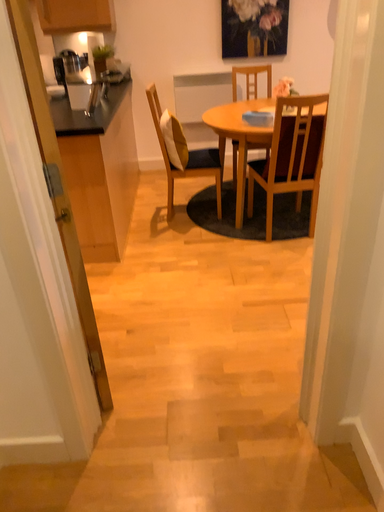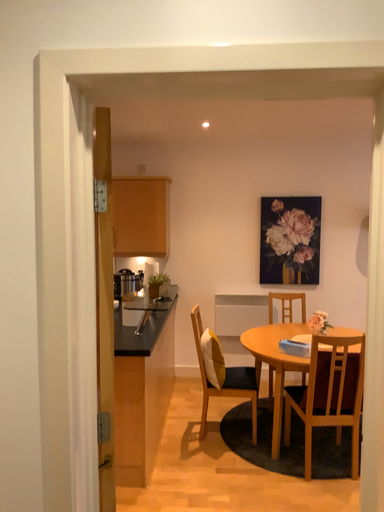
Question: Which way did the camera rotate in the video?

Choices:
 (A) rotated downward
 (B) rotated upward

Answer: (B)